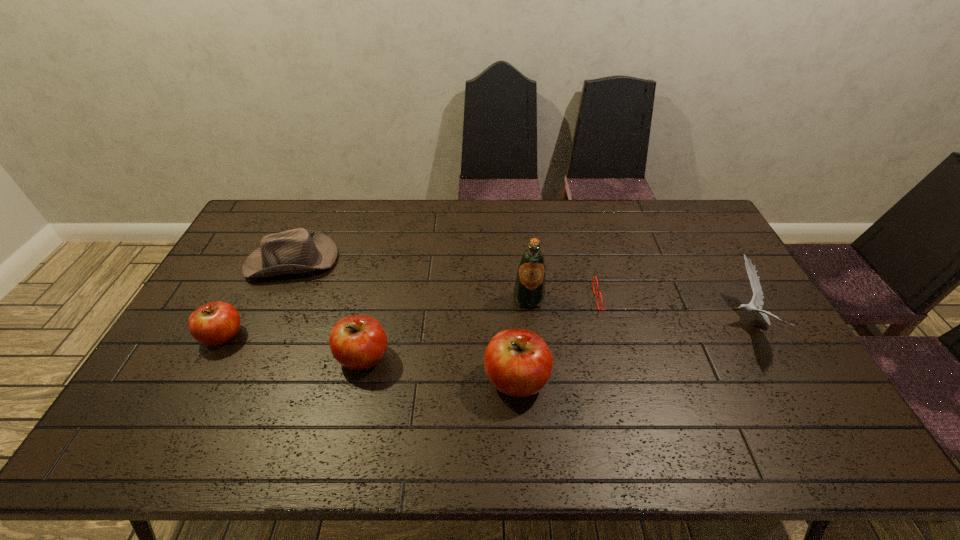
The image size is (960, 540). I want to click on object at the near edge, so click(x=518, y=362).

At what (x,y) coordinates should I click in order to perform the action: click on apple situated at the left edge. Please return your answer as a coordinate pair (x, y). This screenshot has height=540, width=960. Looking at the image, I should click on (214, 323).

I want to click on fedora that is at the left edge, so click(x=298, y=250).

Find the location of a particular element. The image size is (960, 540). object that is positioned at the right edge is located at coordinates (757, 300).

In the image, there is a desktop. Where is `vacant space at the far edge`? The image size is (960, 540). vacant space at the far edge is located at coordinates (505, 217).

This screenshot has width=960, height=540. I want to click on free point at the near edge, so click(x=262, y=392).

In the image, there is a desktop. Identify the location of vacant space at the left edge. pos(201,303).

Where is `vacant space at the right edge of the desktop`? The width and height of the screenshot is (960, 540). vacant space at the right edge of the desktop is located at coordinates (755, 338).

Identify the location of blank region between the olive oil and the shortest apple. Image resolution: width=960 pixels, height=540 pixels. (375, 318).

You are a GUI agent. You are given a task and a screenshot of the screen. Output one action in this format:
    pyautogui.click(x=<x>, y=<y>)
    Task: Click on the vacant space that is in between the shortest object and the second apple from left to right
    The image size is (960, 540).
    Given the screenshot: What is the action you would take?
    pyautogui.click(x=491, y=328)